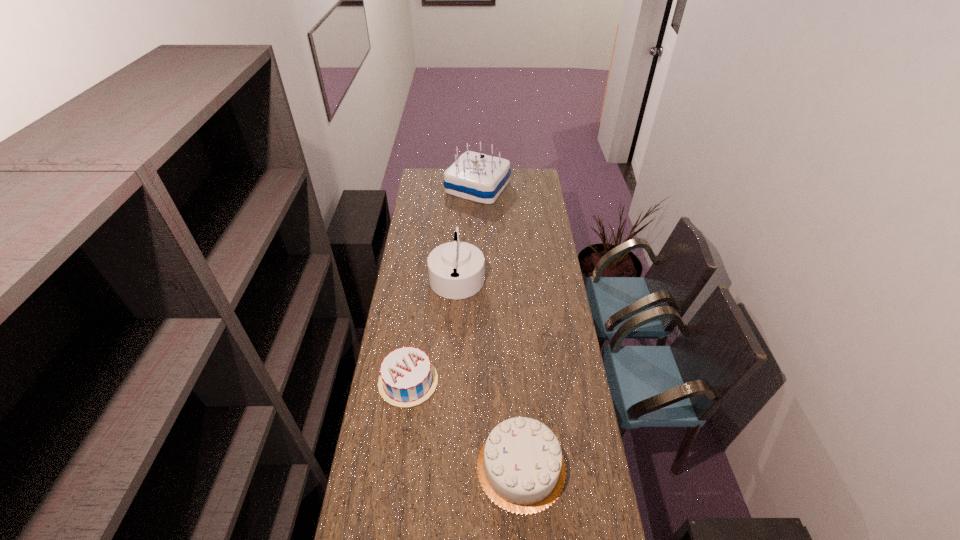
In order to click on the tallest birthday cake in this screenshot , I will do `click(474, 176)`.

The image size is (960, 540). I want to click on the farthest birthday cake, so click(x=474, y=176).

I want to click on the second tallest object, so click(x=456, y=269).

Locate an element on the screen. This screenshot has height=540, width=960. kettle is located at coordinates (456, 269).

Identify the location of the third tallest object. Image resolution: width=960 pixels, height=540 pixels. coord(521,468).

Identify the location of the nearest birthday cake. The height and width of the screenshot is (540, 960). (521, 468).

Locate an element on the screen. Image resolution: width=960 pixels, height=540 pixels. the shortest object is located at coordinates (407, 378).

Where is `the second nearest birthday cake`? the second nearest birthday cake is located at coordinates (407, 378).

This screenshot has width=960, height=540. I want to click on free point located 0.120m on the left of the farthest birthday cake, so click(425, 187).

The width and height of the screenshot is (960, 540). What are the coordinates of `vacant region located 0.270m on the spout of the second farthest object` in the screenshot? It's located at (538, 275).